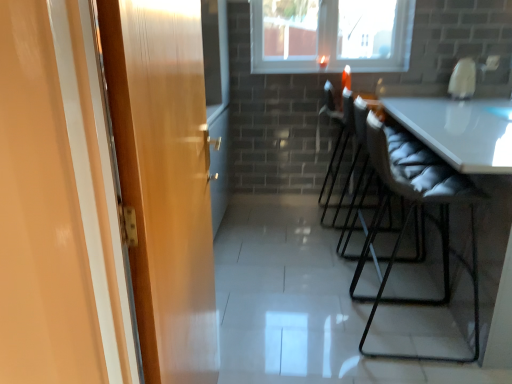
Question: Are matte gray chair at center right, the second chair when ordered from front to back, and black leather chair at center, acting as the 1th chair starting from the back, located far from each other?

Choices:
 (A) yes
 (B) no

Answer: (B)

Question: Does matte gray chair at center right, the second chair when ordered from front to back, come behind black leather chair at center, acting as the 1th chair starting from the back?

Choices:
 (A) no
 (B) yes

Answer: (A)

Question: Does matte gray chair at center right, positioned as the 2th chair in back-to-front order, appear on the right side of black leather chair at center, acting as the third chair starting from the front?

Choices:
 (A) no
 (B) yes

Answer: (B)

Question: Is matte gray chair at center right, the second chair when ordered from front to back, placed right next to black leather chair at center, acting as the third chair starting from the front?

Choices:
 (A) yes
 (B) no

Answer: (B)

Question: Considering the relative positions of matte gray chair at center right, positioned as the 2th chair in back-to-front order, and black leather chair at center, acting as the 1th chair starting from the back, in the image provided, is matte gray chair at center right, positioned as the 2th chair in back-to-front order, to the left of black leather chair at center, acting as the 1th chair starting from the back, from the viewer's perspective?

Choices:
 (A) yes
 (B) no

Answer: (B)

Question: In the image, is gray quilted cushion at right, the 1th chair positioned from the front, positioned in front of or behind wooden door at left?

Choices:
 (A) front
 (B) behind

Answer: (B)

Question: In terms of width, does gray quilted cushion at right, which appears as the third chair when viewed from the back, look wider or thinner when compared to wooden door at left?

Choices:
 (A) wide
 (B) thin

Answer: (A)

Question: Is point (440, 211) positioned closer to the camera than point (122, 140)?

Choices:
 (A) closer
 (B) farther

Answer: (B)

Question: Considering the positions of gray quilted cushion at right, which appears as the third chair when viewed from the back, and wooden door at left in the image, is gray quilted cushion at right, which appears as the third chair when viewed from the back, taller or shorter than wooden door at left?

Choices:
 (A) short
 (B) tall

Answer: (A)

Question: In the image, is matte gray chair at center right, positioned as the 2th chair in back-to-front order, positioned in front of or behind black leather chair at center, acting as the 1th chair starting from the back?

Choices:
 (A) front
 (B) behind

Answer: (A)

Question: Is matte gray chair at center right, the second chair when ordered from front to back, taller or shorter than black leather chair at center, acting as the third chair starting from the front?

Choices:
 (A) tall
 (B) short

Answer: (A)

Question: Looking at their shapes, would you say matte gray chair at center right, positioned as the 2th chair in back-to-front order, is wider or thinner than black leather chair at center, acting as the third chair starting from the front?

Choices:
 (A) wide
 (B) thin

Answer: (B)

Question: Is matte gray chair at center right, positioned as the 2th chair in back-to-front order, spatially inside black leather chair at center, acting as the third chair starting from the front, or outside of it?

Choices:
 (A) outside
 (B) inside

Answer: (A)

Question: From the image's perspective, is gray quilted cushion at right, the 1th chair positioned from the front, above or below black leather chair at center, acting as the third chair starting from the front?

Choices:
 (A) below
 (B) above

Answer: (A)

Question: Looking at their shapes, would you say gray quilted cushion at right, which appears as the third chair when viewed from the back, is wider or thinner than black leather chair at center, acting as the 1th chair starting from the back?

Choices:
 (A) thin
 (B) wide

Answer: (B)